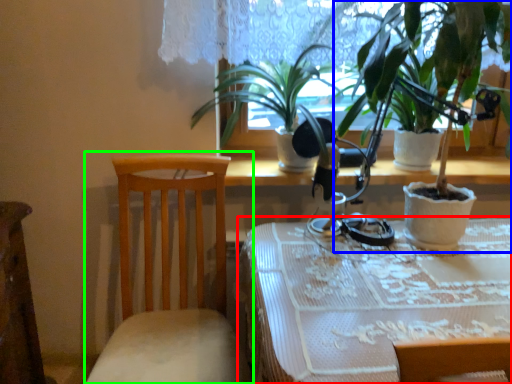
Question: Which object is the farthest from table (highlighted by a red box)? Choose among these: houseplant (highlighted by a blue box) or chair (highlighted by a green box).

Choices:
 (A) houseplant
 (B) chair

Answer: (A)